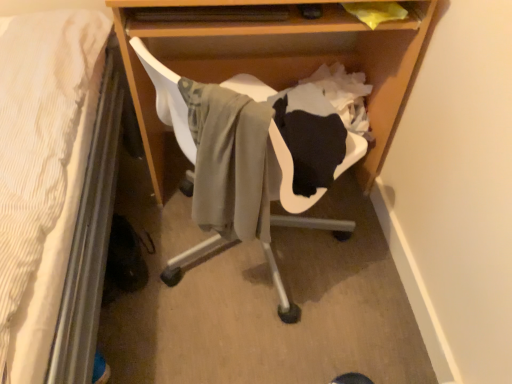
Image resolution: width=512 pixels, height=384 pixels. Describe the element at coordinates (281, 171) in the screenshot. I see `white plastic swivel chair at center` at that location.

At what (x,y) coordinates should I click in order to perform the action: click on white plastic swivel chair at center. Please return your answer as a coordinate pair (x, y). Image resolution: width=512 pixels, height=384 pixels. Looking at the image, I should click on (281, 171).

The image size is (512, 384). Identify the location of wooden desk at center. (275, 60).

The height and width of the screenshot is (384, 512). What do you see at coordinates (275, 60) in the screenshot?
I see `wooden desk at center` at bounding box center [275, 60].

Where is `white plastic swivel chair at center`? The width and height of the screenshot is (512, 384). white plastic swivel chair at center is located at coordinates (281, 171).

Is white plastic swivel chair at center to the left or to the right of wooden desk at center in the image?

Clearly, white plastic swivel chair at center is on the left of wooden desk at center in the image.

Does white plastic swivel chair at center lie behind wooden desk at center?

No, the depth of white plastic swivel chair at center is less than that of wooden desk at center.

Between point (271, 272) and point (379, 167), which one is positioned behind?

The point (379, 167) is farther.

From the image's perspective, is white plastic swivel chair at center above or below wooden desk at center?

Based on their image positions, white plastic swivel chair at center is located beneath wooden desk at center.

From a real-world perspective, is white plastic swivel chair at center on wooden desk at center?

Correct, in the physical world, white plastic swivel chair at center is higher than wooden desk at center.

Between white plastic swivel chair at center and wooden desk at center, which one has larger width?

With larger width is wooden desk at center.

Is white plastic swivel chair at center shorter than wooden desk at center?

Indeed, white plastic swivel chair at center has a lesser height compared to wooden desk at center.

Considering the sizes of objects white plastic swivel chair at center and wooden desk at center in the image provided, who is bigger, white plastic swivel chair at center or wooden desk at center?

With larger size is wooden desk at center.

Is wooden desk at center a part of white plastic swivel chair at center?

Definitely not — wooden desk at center is not inside white plastic swivel chair at center.

Are white plastic swivel chair at center and wooden desk at center making contact?

There is a gap between white plastic swivel chair at center and wooden desk at center.

Is white plastic swivel chair at center positioned with its back to wooden desk at center?

→ white plastic swivel chair at center is not turned away from wooden desk at center.

How different are the orientations of white plastic swivel chair at center and wooden desk at center in degrees?

The angular difference between white plastic swivel chair at center and wooden desk at center is 138 degrees.

How far apart are white plastic swivel chair at center and wooden desk at center?

14.84 inches.

You are a GUI agent. You are given a task and a screenshot of the screen. Output one action in this format:
    pyautogui.click(x=<x>, y=<y>)
    Task: Click on the desk below the white plastic swivel chair at center (from a real-world perspective)
    
    Given the screenshot: What is the action you would take?
    pyautogui.click(x=275, y=60)

Based on their positions, is wooden desk at center located to the left or right of white plastic swivel chair at center?

From the image, it's evident that wooden desk at center is to the right of white plastic swivel chair at center.

Is wooden desk at center closer to camera compared to white plastic swivel chair at center?

No, wooden desk at center is further to the viewer.

Is point (382, 51) closer to camera compared to point (319, 190)?

No, (382, 51) is further to viewer.

Consider the image. From the image's perspective, is wooden desk at center on top of white plastic swivel chair at center?

Yes, from the image's perspective, wooden desk at center is above white plastic swivel chair at center.

From a real-world perspective, is wooden desk at center positioned above or below white plastic swivel chair at center?

wooden desk at center is situated lower than white plastic swivel chair at center in the real world.

Considering the sizes of wooden desk at center and white plastic swivel chair at center in the image, is wooden desk at center wider or thinner than white plastic swivel chair at center?

Clearly, wooden desk at center has more width compared to white plastic swivel chair at center.

Considering the relative sizes of wooden desk at center and white plastic swivel chair at center in the image provided, is wooden desk at center taller than white plastic swivel chair at center?

Indeed, wooden desk at center has a greater height compared to white plastic swivel chair at center.

Does wooden desk at center have a smaller size compared to white plastic swivel chair at center?

Actually, wooden desk at center might be larger than white plastic swivel chair at center.

Would you say white plastic swivel chair at center is part of wooden desk at center's contents?

No, white plastic swivel chair at center is located outside of wooden desk at center.

Is wooden desk at center touching white plastic swivel chair at center?

They are not placed beside each other.

Could you tell me if wooden desk at center is facing white plastic swivel chair at center?

Yes, wooden desk at center is oriented towards white plastic swivel chair at center.

Can you tell me how much wooden desk at center and white plastic swivel chair at center differ in facing direction?

138 degrees separate the facing orientations of wooden desk at center and white plastic swivel chair at center.

The width and height of the screenshot is (512, 384). Find the location of `swivel chair below the wooden desk at center (from the image's perspective)`. swivel chair below the wooden desk at center (from the image's perspective) is located at coordinates (281, 171).

Locate an element on the screen. The width and height of the screenshot is (512, 384). desk that is under the white plastic swivel chair at center (from a real-world perspective) is located at coordinates (275, 60).

You are a GUI agent. You are given a task and a screenshot of the screen. Output one action in this format:
    pyautogui.click(x=<x>, y=<y>)
    Task: Click on the swivel chair on the left of wooden desk at center
    The height and width of the screenshot is (384, 512).
    Given the screenshot: What is the action you would take?
    pyautogui.click(x=281, y=171)